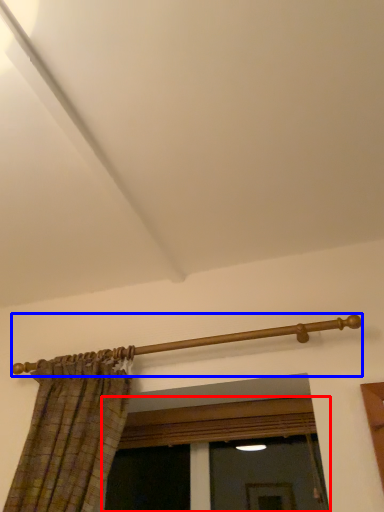
Question: Which object is closer to the camera taking this photo, window (highlighted by a red box) or rail (highlighted by a blue box)?

Choices:
 (A) window
 (B) rail

Answer: (B)